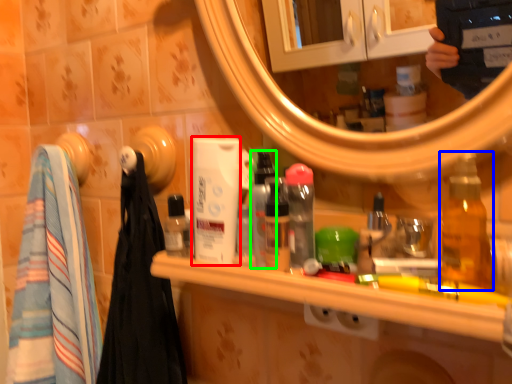
Question: Which object is the closest to the mouthwash (highlighted by a red box)? Choose among these: bottle (highlighted by a blue box) or bottle (highlighted by a green box).

Choices:
 (A) bottle
 (B) bottle

Answer: (B)